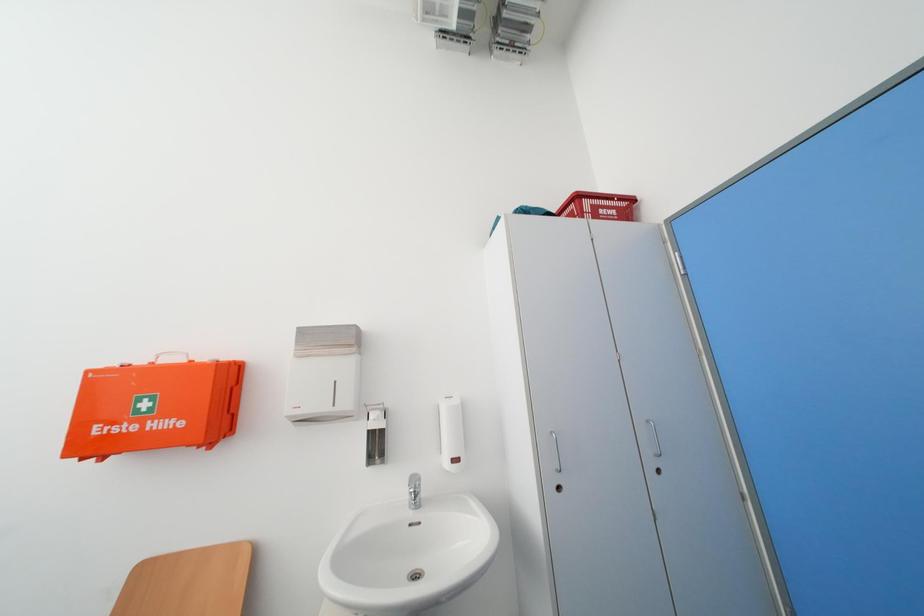
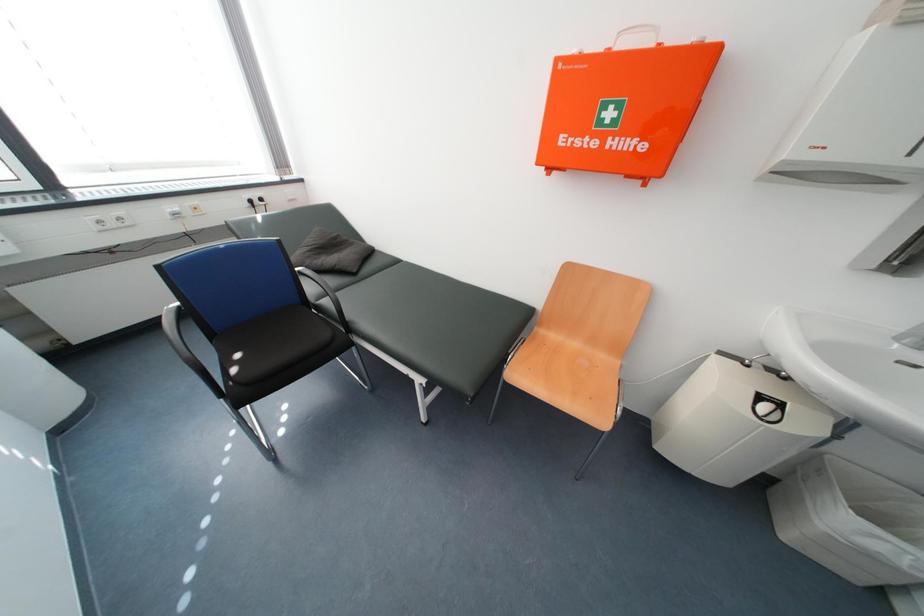
The images are taken continuously from a first-person perspective. In which direction is your viewpoint rotating?

The camera's rotation is toward left-down.